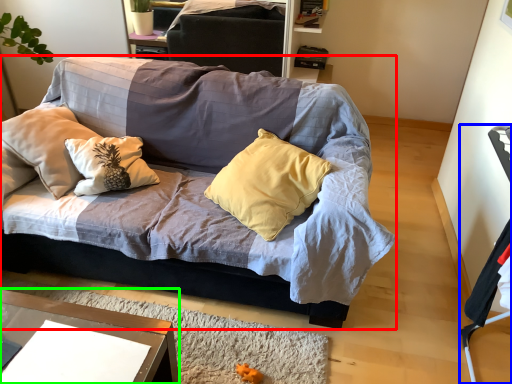
Question: Which object is positioned closest to studio couch (highlighted by a red box)? Select from armchair (highlighted by a blue box) and desk (highlighted by a green box).

Choices:
 (A) armchair
 (B) desk

Answer: (B)